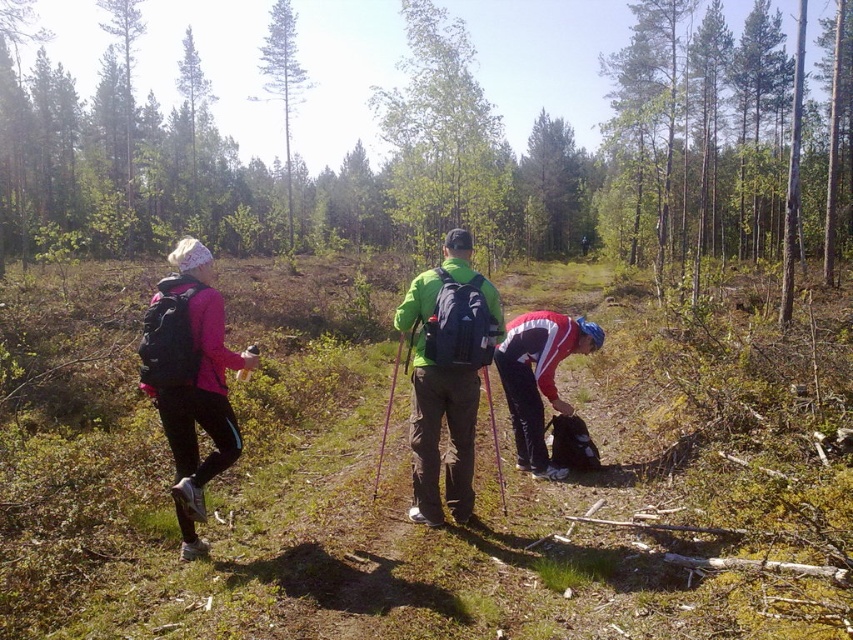
Question: Which object is the farthest from the green leafy tree at center?

Choices:
 (A) green matte jacket at center
 (B) matte black backpack at left
 (C) green smooth tree at upper center
 (D) red and white jacket at lower center

Answer: (B)

Question: Which point appears farthest from the camera in this image?

Choices:
 (A) (476, 170)
 (B) (293, 93)
 (C) (175, 474)

Answer: (B)

Question: Can you confirm if matte black backpack at left is positioned above red and white jacket at lower center?

Choices:
 (A) yes
 (B) no

Answer: (A)

Question: Where is matte black backpack at left located in relation to red and white jacket at lower center in the image?

Choices:
 (A) right
 (B) left

Answer: (B)

Question: Which object is the farthest from the green leafy tree at center?

Choices:
 (A) matte black backpack at left
 (B) red and white jacket at lower center
 (C) green matte jacket at center

Answer: (A)

Question: Does green leafy tree at center appear on the right side of green smooth tree at upper center?

Choices:
 (A) no
 (B) yes

Answer: (B)